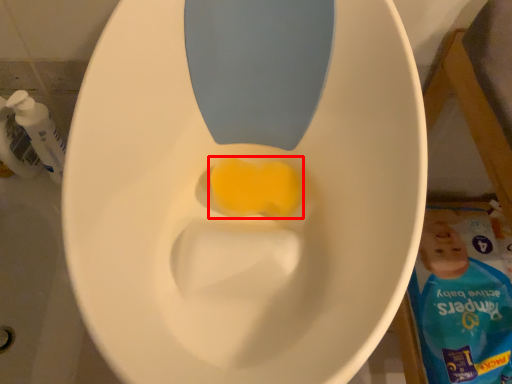
Question: In this image, where is food (annotated by the red box) located relative to cleaning product?

Choices:
 (A) left
 (B) right

Answer: (B)